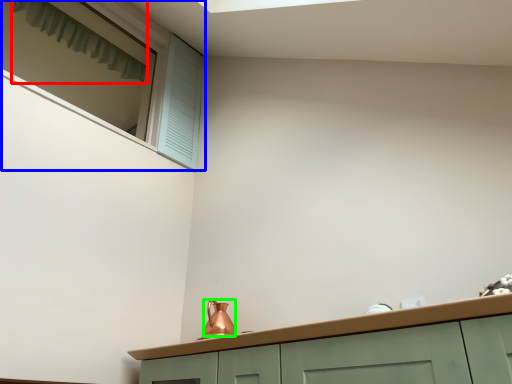
Question: Which object is the closest to the curtain (highlighted by a red box)? Choose among these: window (highlighted by a blue box) or tea pot (highlighted by a green box).

Choices:
 (A) window
 (B) tea pot

Answer: (A)